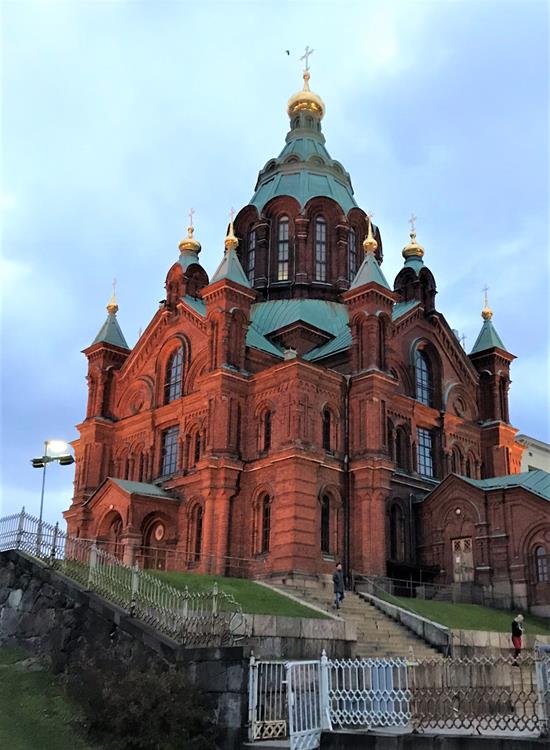
You are a GUI agent. You are given a task and a screenshot of the screen. Output one action in this format:
    pyautogui.click(x=<x>, y=<y>)
    Task: Click on the windows at the top
    The image size is (550, 750).
    Given the screenshot: What is the action you would take?
    pyautogui.click(x=46, y=458), pyautogui.click(x=282, y=246), pyautogui.click(x=320, y=243), pyautogui.click(x=352, y=254), pyautogui.click(x=250, y=254)